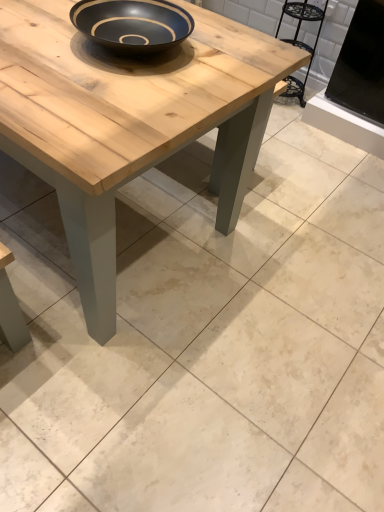
Question: Is natural wood coffee table at center to the left or to the right of metallic black chair at upper right in the image?

Choices:
 (A) right
 (B) left

Answer: (B)

Question: Considering the positions of natural wood coffee table at center and metallic black chair at upper right in the image, is natural wood coffee table at center bigger or smaller than metallic black chair at upper right?

Choices:
 (A) small
 (B) big

Answer: (B)

Question: Considering the positions of natural wood coffee table at center and metallic black chair at upper right in the image, is natural wood coffee table at center taller or shorter than metallic black chair at upper right?

Choices:
 (A) tall
 (B) short

Answer: (A)

Question: Looking at their shapes, would you say metallic black chair at upper right is wider or thinner than natural wood coffee table at center?

Choices:
 (A) wide
 (B) thin

Answer: (B)

Question: Considering their positions, is metallic black chair at upper right located in front of or behind natural wood coffee table at center?

Choices:
 (A) front
 (B) behind

Answer: (B)

Question: Looking at the image, does metallic black chair at upper right seem bigger or smaller compared to natural wood coffee table at center?

Choices:
 (A) small
 (B) big

Answer: (A)

Question: Considering the relative positions of metallic black chair at upper right and natural wood coffee table at center in the image provided, is metallic black chair at upper right to the left or to the right of natural wood coffee table at center?

Choices:
 (A) left
 (B) right

Answer: (B)